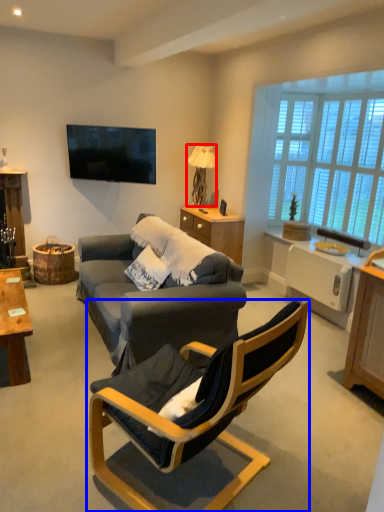
Question: Which of the following is the closest to the observer, lamp (highlighted by a red box) or chair (highlighted by a blue box)?

Choices:
 (A) lamp
 (B) chair

Answer: (B)